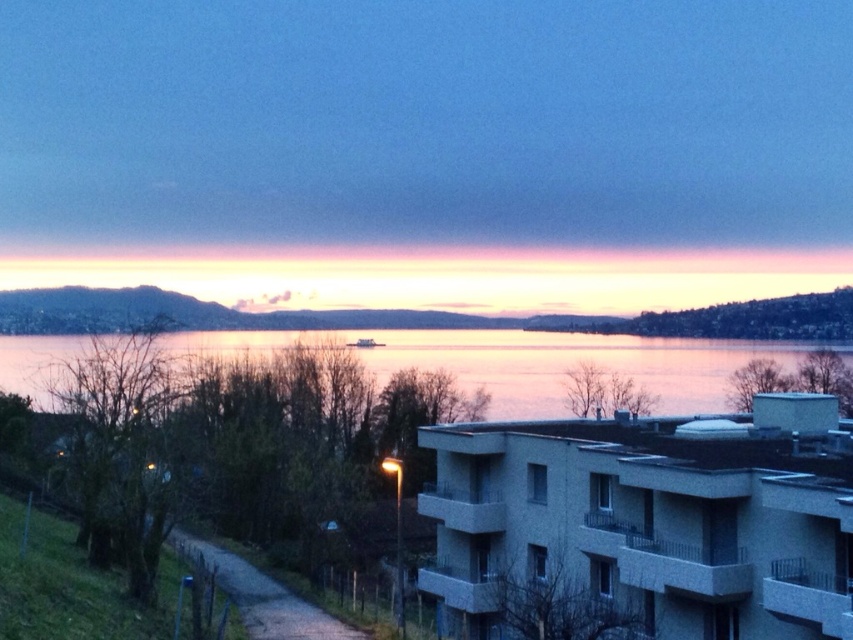
You are standing at the edge of the lake and want to take a photo of the silvery reflective water at center. If your camera can focus on objects up to 60 meters away, will it be able to capture the water clearly?

The silvery reflective water at center is 62.55 meters away from the camera. Since the camera can only focus up to 60 meters, it will not be able to capture the water clearly.